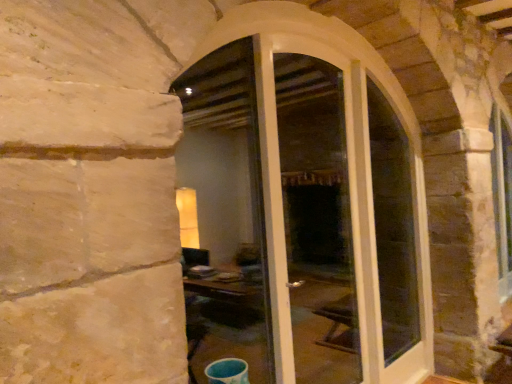
Question: Is white glossy screen door at center looking in the opposite direction of clear glass door at center?

Choices:
 (A) yes
 (B) no

Answer: (B)

Question: From the image's perspective, is white glossy screen door at center beneath clear glass door at center?

Choices:
 (A) yes
 (B) no

Answer: (A)

Question: Can you confirm if white glossy screen door at center is bigger than clear glass door at center?

Choices:
 (A) no
 (B) yes

Answer: (B)

Question: Does white glossy screen door at center have a smaller size compared to clear glass door at center?

Choices:
 (A) yes
 (B) no

Answer: (B)

Question: Can you confirm if white glossy screen door at center is taller than clear glass door at center?

Choices:
 (A) no
 (B) yes

Answer: (B)

Question: Is white glossy screen door at center bigger or smaller than white glass door at center?

Choices:
 (A) big
 (B) small

Answer: (B)

Question: Based on their positions, is white glossy screen door at center located to the left or right of white glass door at center?

Choices:
 (A) left
 (B) right

Answer: (A)

Question: In the image, is white glossy screen door at center positioned in front of or behind white glass door at center?

Choices:
 (A) behind
 (B) front

Answer: (A)

Question: Do you think white glossy screen door at center is within white glass door at center, or outside of it?

Choices:
 (A) outside
 (B) inside

Answer: (B)

Question: Is clear glass door at center spatially inside white glass door at center, or outside of it?

Choices:
 (A) inside
 (B) outside

Answer: (A)

Question: From the image's perspective, is clear glass door at center positioned above or below white glass door at center?

Choices:
 (A) below
 (B) above

Answer: (B)

Question: From a real-world perspective, is clear glass door at center positioned above or below white glass door at center?

Choices:
 (A) below
 (B) above

Answer: (B)

Question: Based on their sizes in the image, would you say clear glass door at center is bigger or smaller than white glass door at center?

Choices:
 (A) small
 (B) big

Answer: (A)

Question: From the image's perspective, relative to white glossy screen door at center, is white glass door at center above or below?

Choices:
 (A) above
 (B) below

Answer: (B)

Question: Is white glass door at center spatially inside white glossy screen door at center, or outside of it?

Choices:
 (A) outside
 (B) inside

Answer: (B)